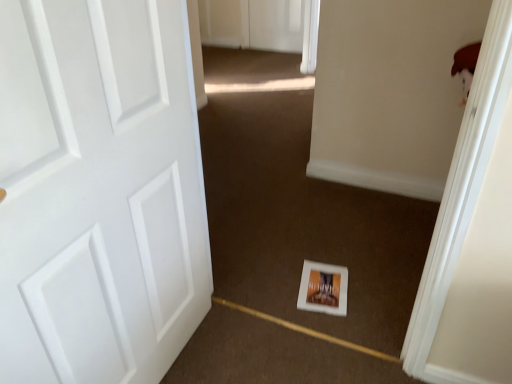
Question: Considering the relative sizes of white matte door at left and white matte postcard at center in the image provided, is white matte door at left wider than white matte postcard at center?

Choices:
 (A) no
 (B) yes

Answer: (A)

Question: Does white matte door at left lie behind white matte postcard at center?

Choices:
 (A) no
 (B) yes

Answer: (A)

Question: Is white matte postcard at center at the back of white matte door at left?

Choices:
 (A) no
 (B) yes

Answer: (A)

Question: Is white matte door at left aimed at white matte postcard at center?

Choices:
 (A) no
 (B) yes

Answer: (A)

Question: From the image's perspective, is white matte door at left above white matte postcard at center?

Choices:
 (A) yes
 (B) no

Answer: (A)

Question: Does white matte door at left appear on the left side of white matte postcard at center?

Choices:
 (A) no
 (B) yes

Answer: (B)

Question: Considering the relative sizes of white matte postcard at center and white matte door at left in the image provided, is white matte postcard at center bigger than white matte door at left?

Choices:
 (A) yes
 (B) no

Answer: (B)

Question: Can you confirm if white matte postcard at center is positioned to the left of white matte door at left?

Choices:
 (A) no
 (B) yes

Answer: (A)

Question: Considering the relative sizes of white matte postcard at center and white matte door at left in the image provided, is white matte postcard at center thinner than white matte door at left?

Choices:
 (A) no
 (B) yes

Answer: (A)

Question: Is the depth of white matte postcard at center greater than that of white matte door at left?

Choices:
 (A) no
 (B) yes

Answer: (B)

Question: Considering the relative sizes of white matte postcard at center and white matte door at left in the image provided, is white matte postcard at center shorter than white matte door at left?

Choices:
 (A) yes
 (B) no

Answer: (A)

Question: Is white matte postcard at center positioned beyond the bounds of white matte door at left?

Choices:
 (A) yes
 (B) no

Answer: (A)

Question: Considering the positions of white matte door at left and white matte postcard at center in the image, is white matte door at left wider or thinner than white matte postcard at center?

Choices:
 (A) wide
 (B) thin

Answer: (B)